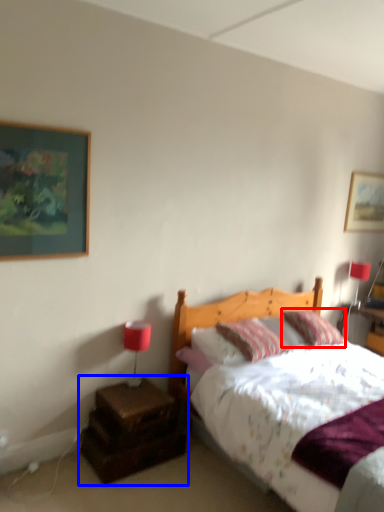
Question: Which point is closer to the camera, pillow (highlighted by a red box) or nightstand (highlighted by a blue box)?

Choices:
 (A) pillow
 (B) nightstand

Answer: (B)